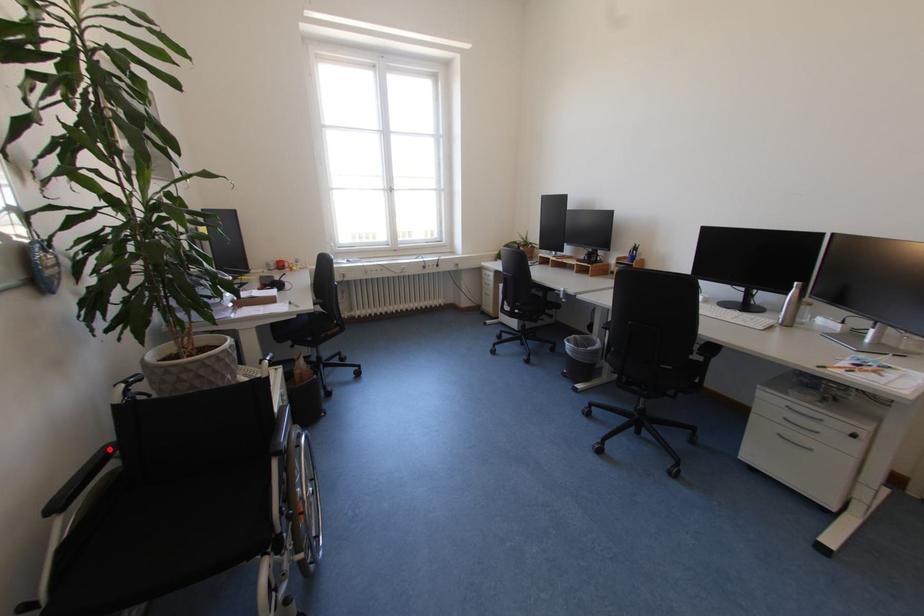
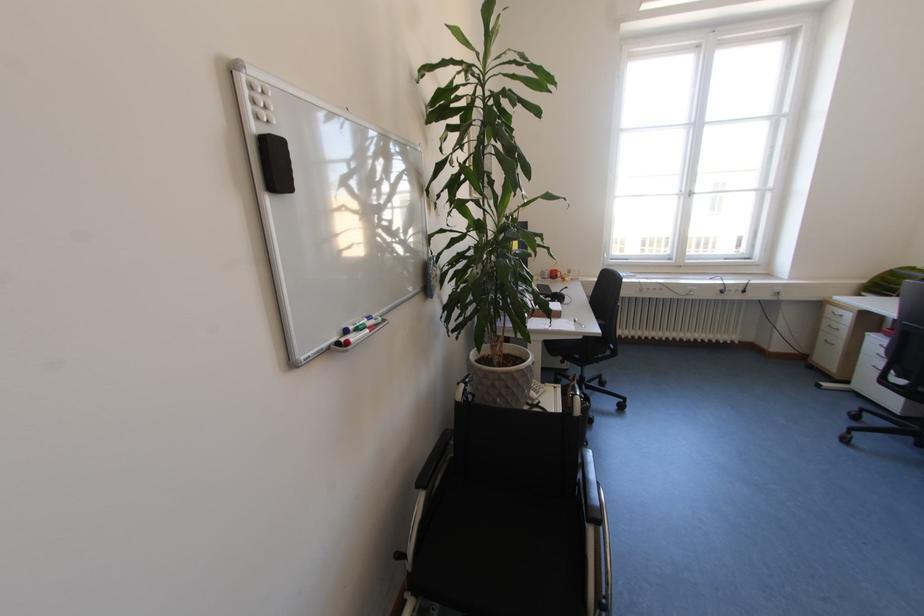
In the second image, find the point that corresponds to the highlighted location in the first image.

(451, 435)